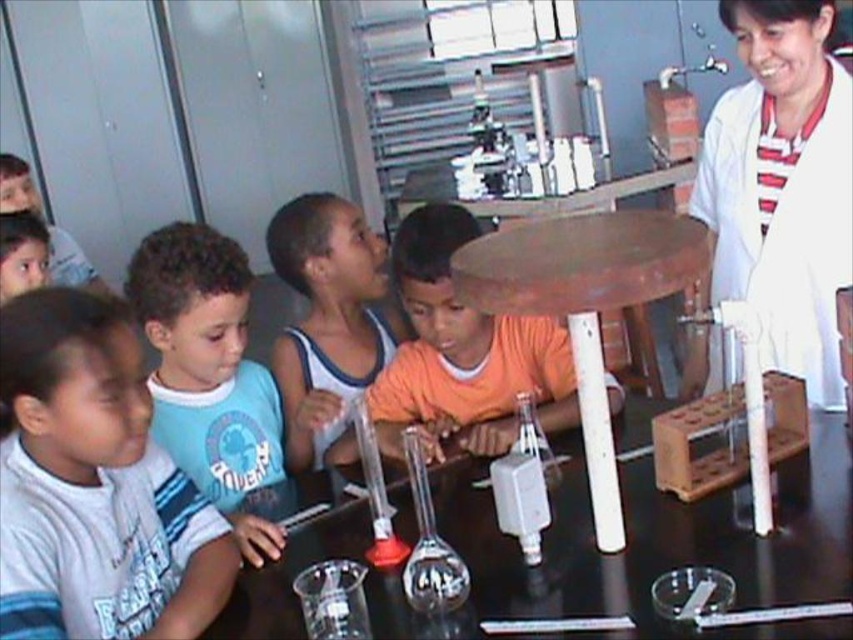
Does transparent glass table at center have a lesser width compared to white striped shirt at left?

Incorrect, transparent glass table at center's width is not less than white striped shirt at left's.

Measure the distance between point (795, 456) and camera.

Point (795, 456) and camera are 1.58 meters apart from each other.

Locate an element on the screen. The height and width of the screenshot is (640, 853). transparent glass table at center is located at coordinates [x=636, y=545].

Which is above, white striped shirt at left or blue cotton shirt at center?

Positioned higher is blue cotton shirt at center.

Measure the distance between point (155,506) and camera.

Point (155,506) and camera are 1.47 meters apart.

Which is in front, point (71, 550) or point (247, 323)?

Point (71, 550) is in front.

Locate an element on the screen. The width and height of the screenshot is (853, 640). white striped shirt at left is located at coordinates (91, 493).

From the picture: Which of these two, orange matte shirt at center or brown wooden table at center, stands shorter?

orange matte shirt at center is shorter.

Between point (398, 292) and point (515, 308), which one is positioned in front?

Point (515, 308)

Is point (415, 376) closer to viewer compared to point (589, 339)?

No, (415, 376) is further to viewer.

I want to click on orange matte shirt at center, so click(x=463, y=353).